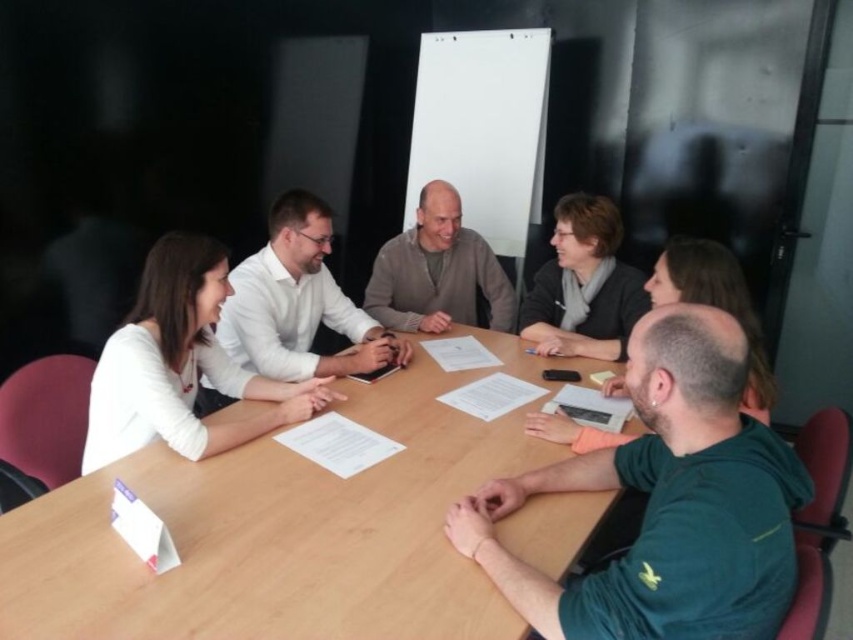
You are sitting at the rectangular wooden table and want to pass a document to the person wearing the matte gray sweater at upper center. Which direction should you move the document to reach them from the green fabric shirt at lower right?

The green fabric shirt at lower right is positioned on the left side of the matte gray sweater at upper center. To pass the document to the matte gray sweater at upper center, move it to the right.

You are a photographer positioned to the side of the table. You need to take a photo that includes both the white matte shirt at upper left and the white shirt at upper left. However, one of them is partially blocked by another object. Which one is more likely to be fully visible in the photo?

The white shirt at upper left is more likely to be fully visible because the white matte shirt at upper left is positioned below it and might be obscured.